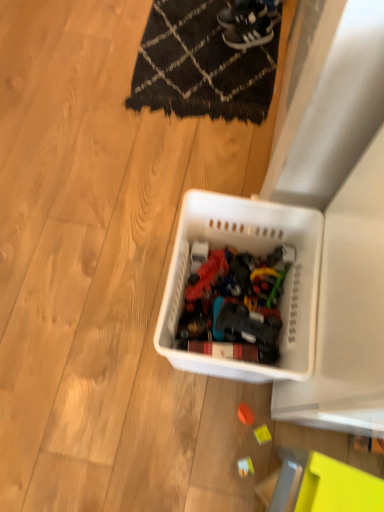
Image resolution: width=384 pixels, height=512 pixels. Find the location of `free region on the left part of white plastic toy at lower center, the third toy in the top-to-bottom sequence`. free region on the left part of white plastic toy at lower center, the third toy in the top-to-bottom sequence is located at coordinates (188, 455).